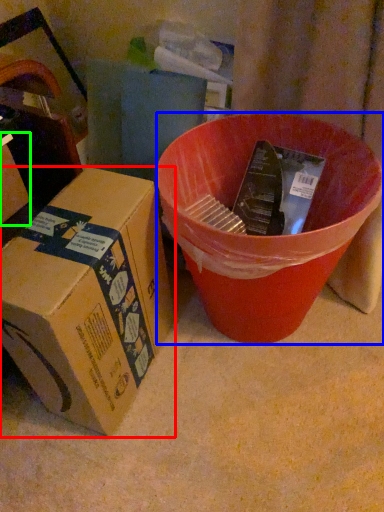
Question: Which object is the closest to the box (highlighted by a red box)? Choose among these: bucket (highlighted by a blue box) or box (highlighted by a green box).

Choices:
 (A) bucket
 (B) box

Answer: (A)